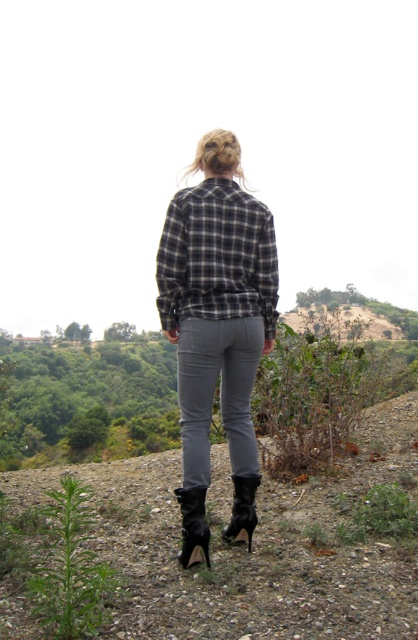
Can you confirm if matte gray pants at center is bigger than black leather boot at lower center?

Yes, matte gray pants at center is bigger than black leather boot at lower center.

Measure the distance between point (x=191, y=372) and camera.

10.25 feet

Image resolution: width=418 pixels, height=640 pixels. Identify the location of matte gray pants at center. (214, 392).

Does black flannel shirt at center have a lesser height compared to black leather boot at lower center?

No.

Does point (188, 253) come closer to viewer compared to point (186, 552)?

No, (188, 253) is further to viewer.

Looking at this image, who is more forward, (219,284) or (208,544)?

Point (208,544)

Locate an element on the screen. This screenshot has width=418, height=640. black flannel shirt at center is located at coordinates (216, 257).

In the scene shown: Is black flannel shirt at center smaller than black patent leather boot at lower center?

Incorrect, black flannel shirt at center is not smaller in size than black patent leather boot at lower center.

Which is above, black flannel shirt at center or black patent leather boot at lower center?

black flannel shirt at center is above.

Is point (168, 284) behind point (247, 484)?

No, (168, 284) is closer to viewer.

Locate an element on the screen. This screenshot has width=418, height=640. black flannel shirt at center is located at coordinates (216, 257).